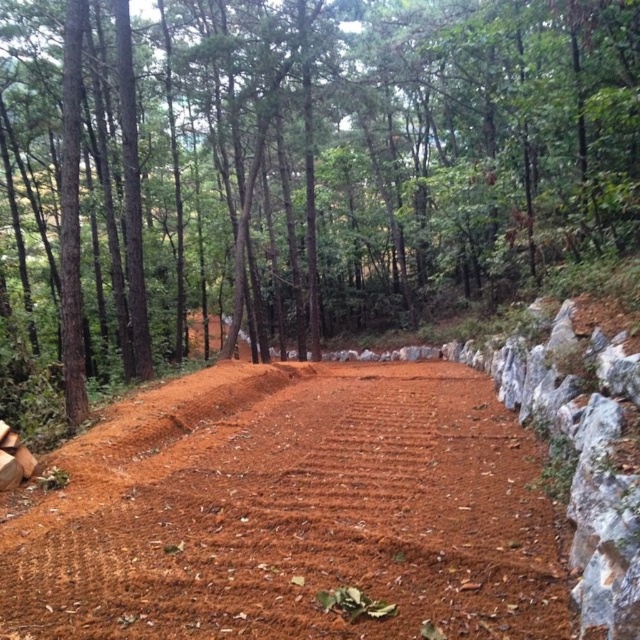
You are standing at the starting point of the dirt path in the forest. You see two points marked on the path. The first point is at coordinate point (554, 140) and the second point is at coordinate point (80, 532). If you want to walk towards the point that is closer to you, which coordinate should you head towards?

You should head towards point (80, 532) because it is closer to you than point (554, 140).

You are standing at the edge of the forest and see the brown dirt road at center and the brown textured dirt track at center. Which path is closer to you?

The brown dirt road at center is 9.98 meters away from the brown textured dirt track at center, so the closer path depends on your current position. However, since both paths are at the center, they are equidistant from you.